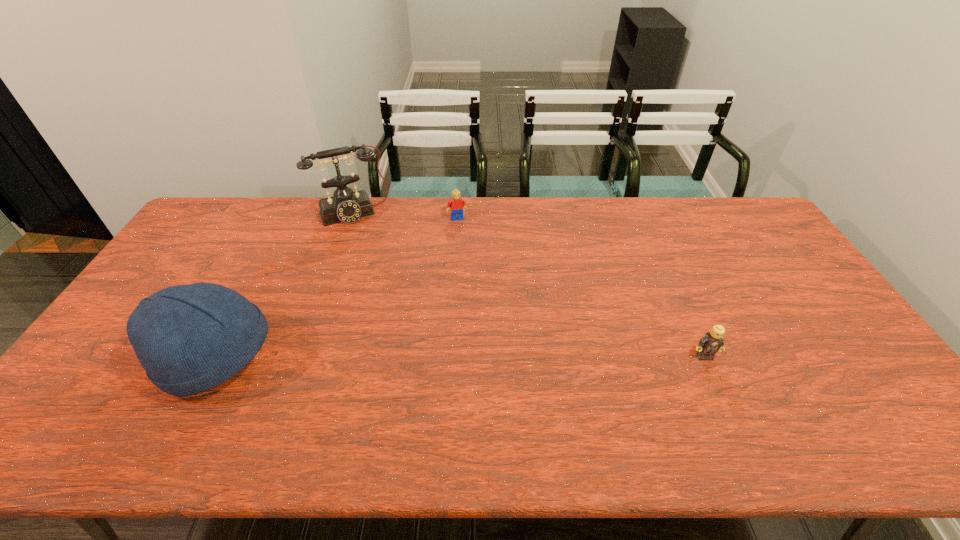
Locate an element on the screen. vacant space at the right edge of the desktop is located at coordinates (784, 302).

The width and height of the screenshot is (960, 540). In order to click on vacant area at the far left corner of the desktop in this screenshot , I will do `click(231, 216)`.

This screenshot has width=960, height=540. Identify the location of vacant region at the far right corner of the desktop. (743, 220).

You are a GUI agent. You are given a task and a screenshot of the screen. Output one action in this format:
    pyautogui.click(x=<x>, y=<y>)
    Task: Click on the free space that is in between the skullcap and the telephone
    This screenshot has width=960, height=540.
    Given the screenshot: What is the action you would take?
    pyautogui.click(x=284, y=286)

In order to click on vacant area between the telephone and the second tallest object in this screenshot , I will do `click(284, 286)`.

At what (x,y) coordinates should I click in order to perform the action: click on vacant space that's between the skullcap and the nearer Lego. Please return your answer as a coordinate pair (x, y). Looking at the image, I should click on (460, 357).

In order to click on vacant area that lies between the skullcap and the left Lego in this screenshot , I will do `click(337, 288)`.

What are the coordinates of `vacant area that lies between the rightmost object and the telephone` in the screenshot? It's located at (528, 285).

Where is `free space that is in between the telephone and the third shortest object`? This screenshot has width=960, height=540. free space that is in between the telephone and the third shortest object is located at coordinates (284, 286).

At what (x,y) coordinates should I click in order to perform the action: click on unoccupied area between the left Lego and the nearer Lego. Please return your answer as a coordinate pair (x, y). Looking at the image, I should click on (581, 287).